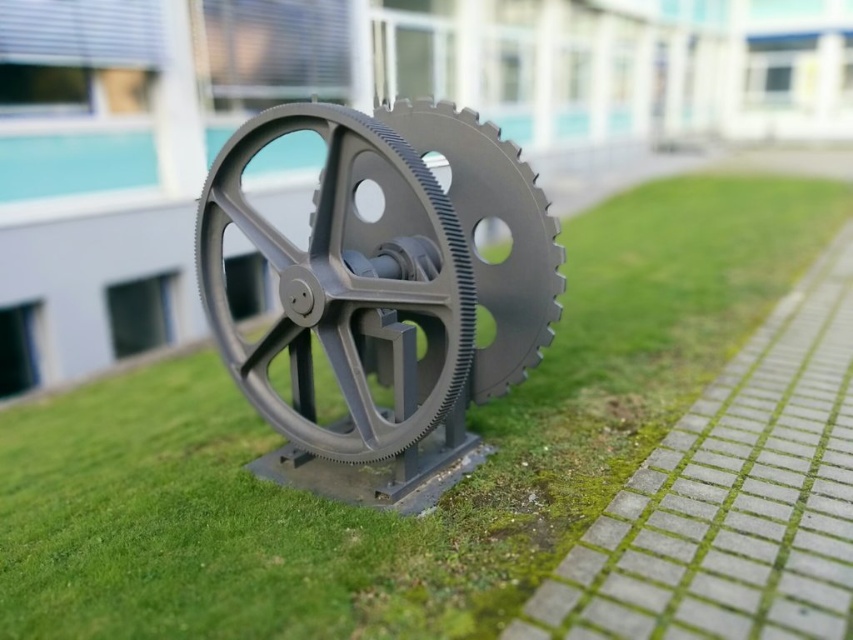
Question: Does green matte grass at center appear over gray matte gear at center?

Choices:
 (A) yes
 (B) no

Answer: (B)

Question: Which point is farther to the camera?

Choices:
 (A) (426, 307)
 (B) (740, 582)

Answer: (A)

Question: Which point is closer to the camera?

Choices:
 (A) (519, 257)
 (B) (221, 317)

Answer: (A)

Question: Considering the real-world distances, which object is closest to the matte gray gear at center?

Choices:
 (A) gray concrete paving at lower right
 (B) green matte grass at center

Answer: (B)

Question: Considering the relative positions of green matte grass at center and matte gray gear at center in the image provided, where is green matte grass at center located with respect to matte gray gear at center?

Choices:
 (A) below
 (B) above

Answer: (B)

Question: Observing the image, what is the correct spatial positioning of green matte grass at center in reference to matte gray gear at center?

Choices:
 (A) below
 (B) above

Answer: (B)